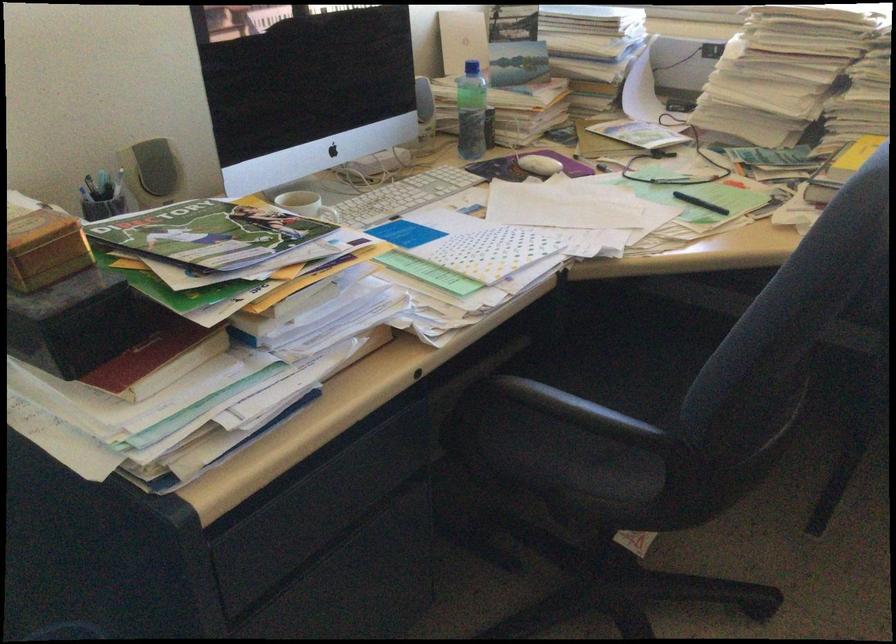
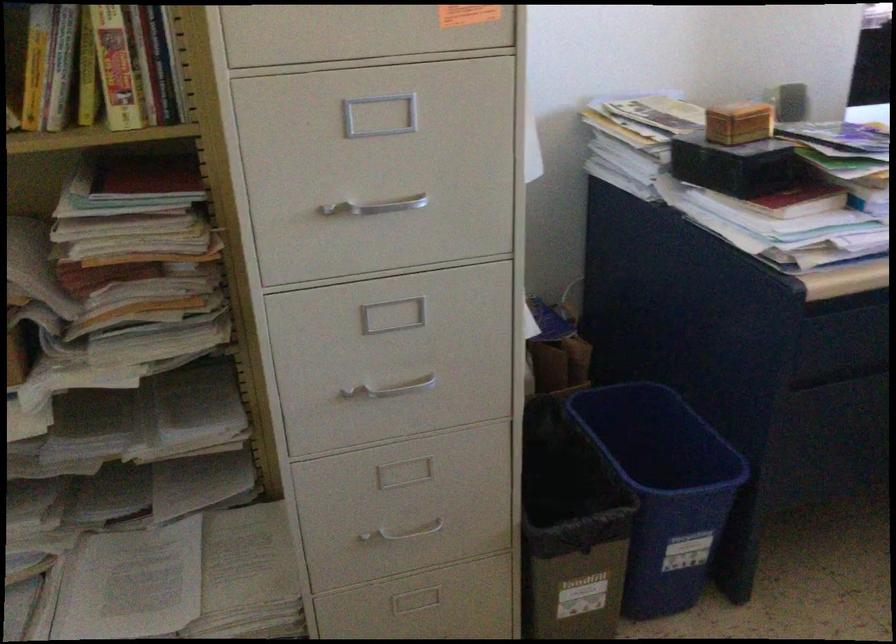
Question: The images are taken continuously from a first-person perspective. In which direction is your viewpoint rotating?

Choices:
 (A) Left
 (B) Right
 (C) Up
 (D) Down

Answer: (A)